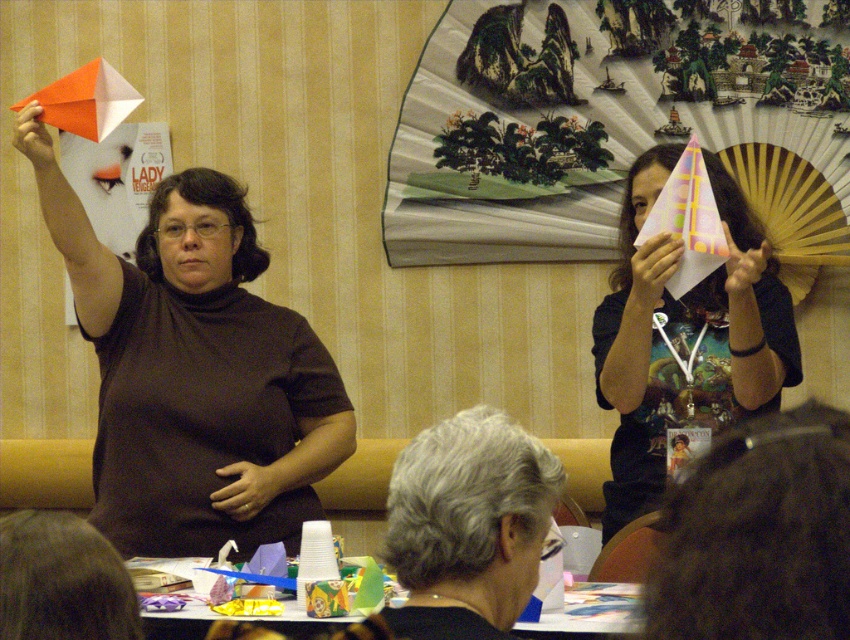
Question: Which of the following is the farthest from the observer?

Choices:
 (A) [x=524, y=632]
 (B) [x=714, y=301]
 (C) [x=208, y=476]

Answer: (B)

Question: Is matte brown shirt at upper left smaller than gray hair at upper center?

Choices:
 (A) yes
 (B) no

Answer: (B)

Question: Can you confirm if matte brown shirt at upper left is positioned above gray hair at upper center?

Choices:
 (A) yes
 (B) no

Answer: (A)

Question: Can you confirm if matte brown shirt at upper left is thinner than matte pink paper fan at upper right?

Choices:
 (A) yes
 (B) no

Answer: (B)

Question: Which object appears closest to the camera in this image?

Choices:
 (A) matte pink paper fan at upper right
 (B) matte brown shirt at upper left
 (C) cardboard paper at lower center
 (D) gray hair at upper center

Answer: (D)

Question: Which of the following is the closest to the observer?

Choices:
 (A) matte brown shirt at upper left
 (B) cardboard paper at lower center
 (C) gray hair at upper center
 (D) matte pink paper fan at upper right

Answer: (C)